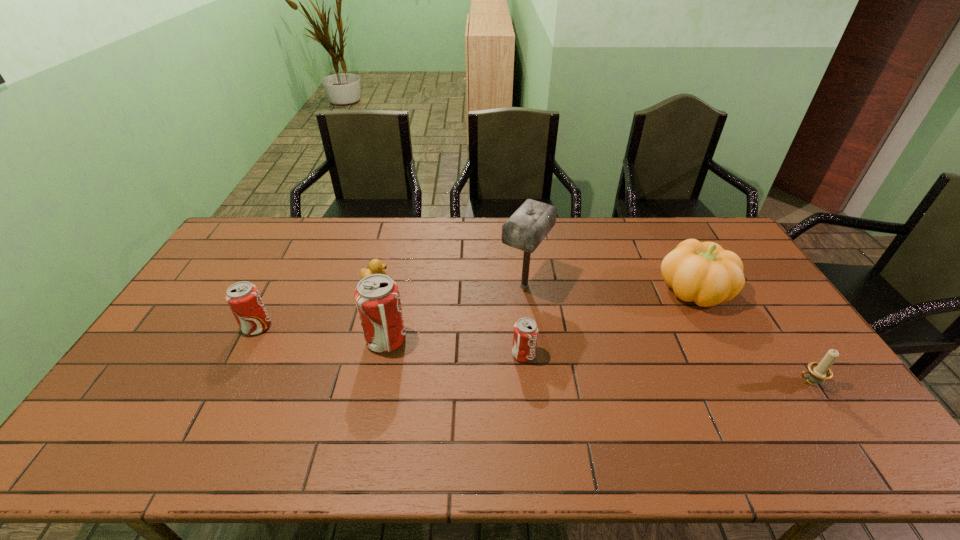
Find the location of `free space that satisfies the following two spatial constraints: 1. on the back side of the mallet; 2. on the left side of the rightmost soda can`. free space that satisfies the following two spatial constraints: 1. on the back side of the mallet; 2. on the left side of the rightmost soda can is located at coordinates (517, 286).

You are a GUI agent. You are given a task and a screenshot of the screen. Output one action in this format:
    pyautogui.click(x=<x>, y=<y>)
    Task: Click on the free space that satisfies the following two spatial constraints: 1. on the back side of the leftmost soda can; 2. on the right side of the tallest object
    This screenshot has height=540, width=960.
    Given the screenshot: What is the action you would take?
    pyautogui.click(x=278, y=286)

Identify the location of vacant area that satisfies the following two spatial constraints: 1. on the face of the duckling; 2. on the back side of the pumpkin. The height and width of the screenshot is (540, 960). (372, 291).

Locate an element on the screen. The image size is (960, 540). free point that satisfies the following two spatial constraints: 1. on the face of the shortest soda can; 2. on the right side of the duckling is located at coordinates (355, 355).